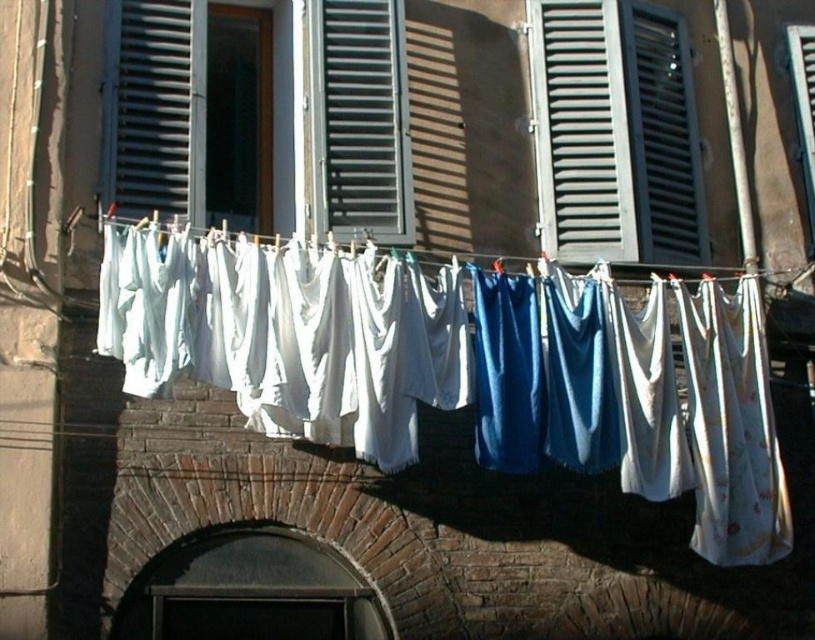
You are standing in front of the building and see two points marked on the clothesline. Which point is closer to you, point (x=650, y=145) or point (x=622, y=266)?

Point (x=622, y=266) is closer to you because point (x=650, y=145) is behind it.

You are standing at the base of the building where the laundry is hanging. You want to retrieve the white cotton sheets at center. Considering the distance, is it feasible for you to reach them without any equipment?

The white cotton sheets at center are 64.86 feet away from the viewer. This distance is too far to reach without specialized equipment, so it would not be feasible to retrieve them by hand.

You are an observer standing in front of the building. You notice the matte gray shutters at upper right and the white fabric at center. Which object appears smaller in size?

The matte gray shutters at upper right has a smaller size compared to the white fabric at center, so the matte gray shutters at upper right appears smaller in size.